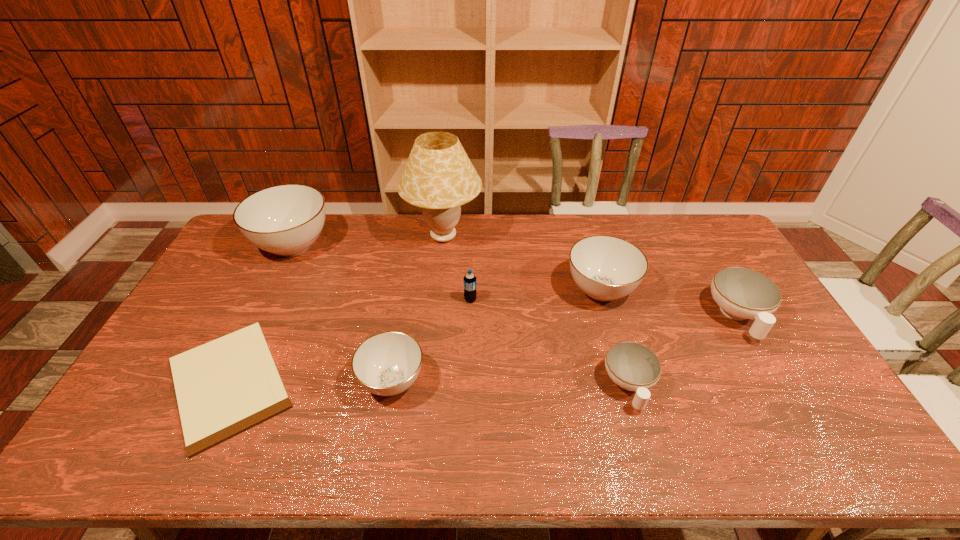
Where is `free space between the shortest object and the fourth shortest chinaware`? free space between the shortest object and the fourth shortest chinaware is located at coordinates (415, 336).

This screenshot has height=540, width=960. Identify the location of free spot between the second shortest object and the second tallest chinaware. (615, 338).

Locate an element on the screen. The image size is (960, 540). free space between the rightmost chinaware and the biggest gray chinaware is located at coordinates (516, 280).

The width and height of the screenshot is (960, 540). Find the location of `free space between the nearest gray chinaware and the shortest object`. free space between the nearest gray chinaware and the shortest object is located at coordinates (311, 382).

Locate which object ranks second in proximity to the soda bottle. Please provide its 2D coordinates. Your answer should be formatted as a tuple, i.e. [(x, y)], where the tuple contains the x and y coordinates of a point satisfying the conditions above.

[(386, 364)]

You are a GUI agent. You are given a task and a screenshot of the screen. Output one action in this format:
    pyautogui.click(x=<x>, y=<y>)
    Task: Click on the object that stands as the fifth closest to the left white chinaware
    This screenshot has width=960, height=540.
    Given the screenshot: What is the action you would take?
    pyautogui.click(x=439, y=177)

Locate which chinaware is the closest to the left white chinaware. Please provide its 2D coordinates. Your answer should be formatted as a tuple, i.e. [(x, y)], where the tuple contains the x and y coordinates of a point satisfying the conditions above.

[(606, 268)]

This screenshot has width=960, height=540. I want to click on chinaware that can be found as the closest to the farther white chinaware, so click(x=606, y=268).

Where is `the third closest gray chinaware to the shortest object`? This screenshot has height=540, width=960. the third closest gray chinaware to the shortest object is located at coordinates (606, 268).

Where is `the second closest gray chinaware to the clipboard`? This screenshot has height=540, width=960. the second closest gray chinaware to the clipboard is located at coordinates (286, 220).